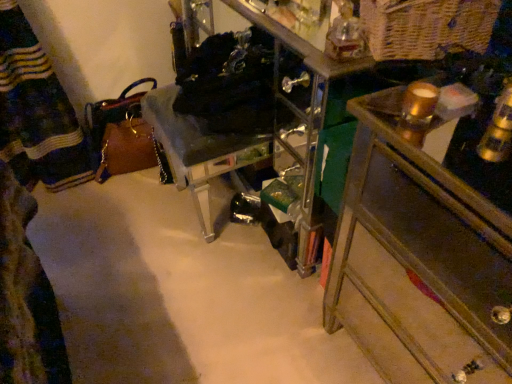
The image size is (512, 384). What are the coordinates of `free space that is to the left of clear acrylic chair at center` in the screenshot? It's located at (121, 221).